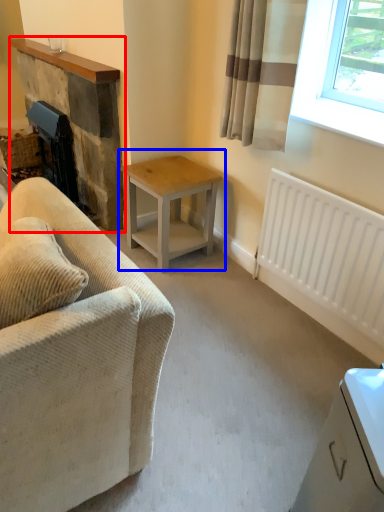
Question: Which object appears farthest to the camera in this image, fireplace (highlighted by a red box) or table (highlighted by a blue box)?

Choices:
 (A) fireplace
 (B) table

Answer: (A)